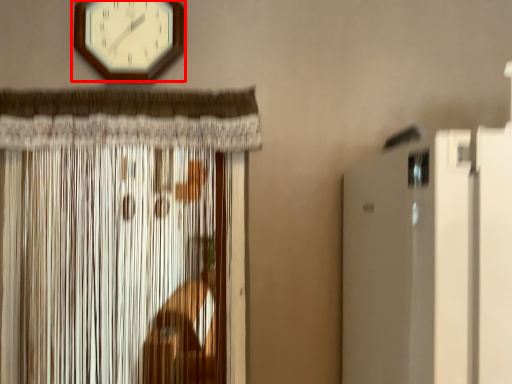
Question: Considering the relative positions of wall clock (annotated by the red box) and curtain in the image provided, where is wall clock (annotated by the red box) located with respect to the staircase?

Choices:
 (A) left
 (B) right

Answer: (B)